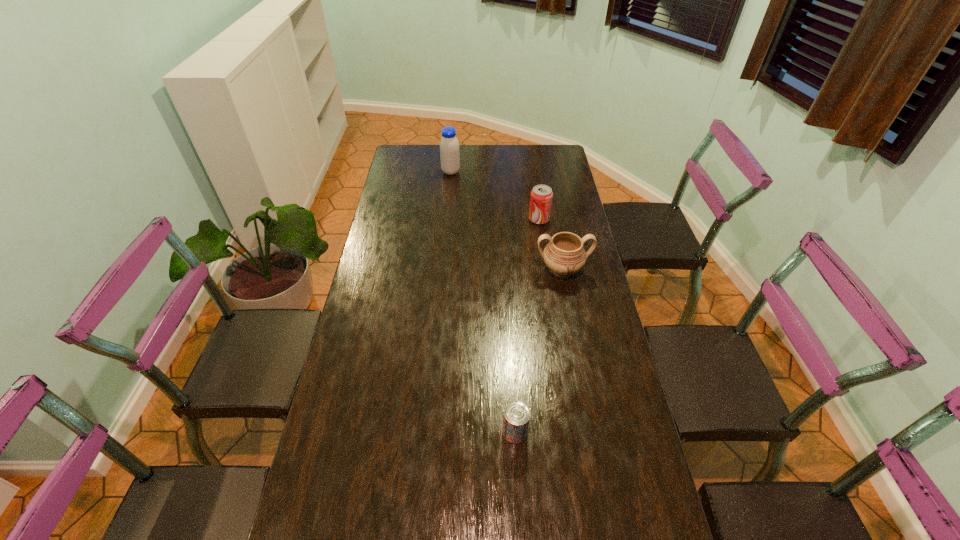
Where is `the farthest object`? This screenshot has height=540, width=960. the farthest object is located at coordinates (449, 146).

Identify the location of the leftmost object. Image resolution: width=960 pixels, height=540 pixels. (449, 146).

The image size is (960, 540). I want to click on urn, so (564, 255).

Identify the location of soda can. The image size is (960, 540). (541, 197).

Where is `the nearest object`? the nearest object is located at coordinates click(516, 419).

Where is `the third object from right to left`? Image resolution: width=960 pixels, height=540 pixels. the third object from right to left is located at coordinates (516, 419).

Where is `free space located 0.160m on the left of the soya milk`? The width and height of the screenshot is (960, 540). free space located 0.160m on the left of the soya milk is located at coordinates (407, 172).

Locate an element on the screen. blank space located 0.380m on the front-facing side of the third farthest object is located at coordinates (583, 380).

You are a GUI agent. You are given a task and a screenshot of the screen. Output one action in this format:
    pyautogui.click(x=<x>, y=<y>)
    Task: Click on the free space located 0.120m on the right of the soda can
    Image resolution: width=960 pixels, height=540 pixels.
    Given the screenshot: What is the action you would take?
    pyautogui.click(x=579, y=219)

Locate an element on the screen. The width and height of the screenshot is (960, 540). free location located on the left of the nearest object is located at coordinates (408, 432).